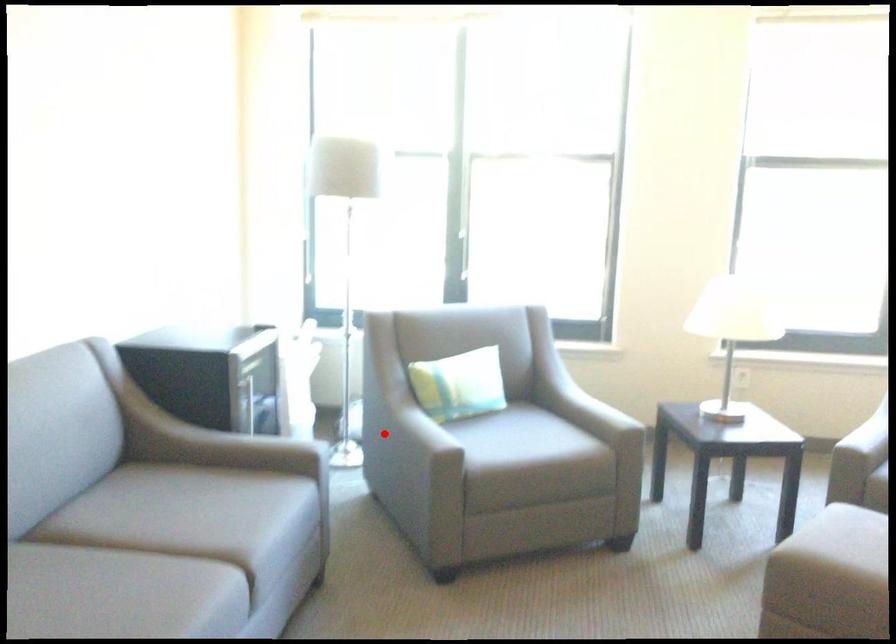
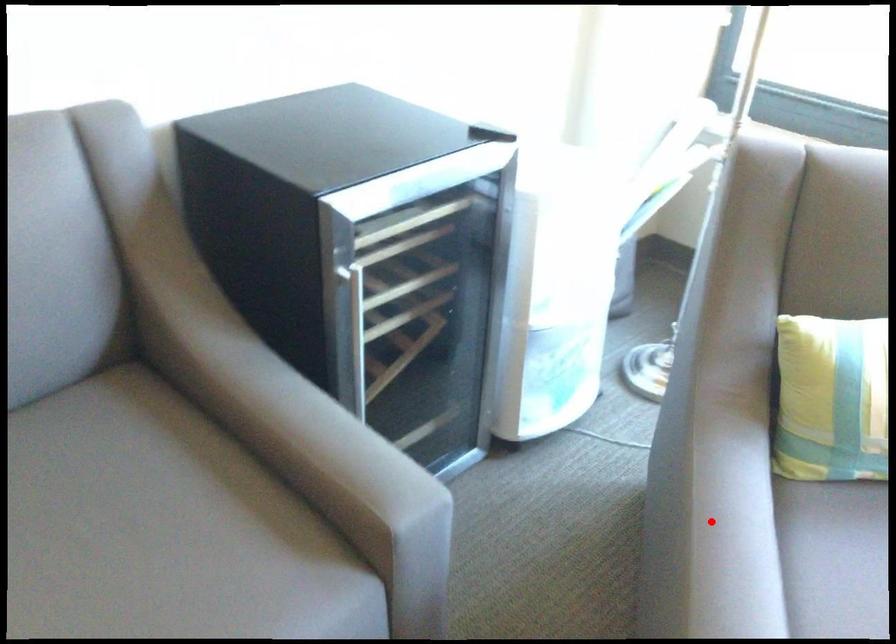
I am providing you with two images of the same scene from different viewpoints. A red point is marked on the first image and another point is marked on the second image. Does the point marked in image1 correspond to the same location as the one in image2?

Yes